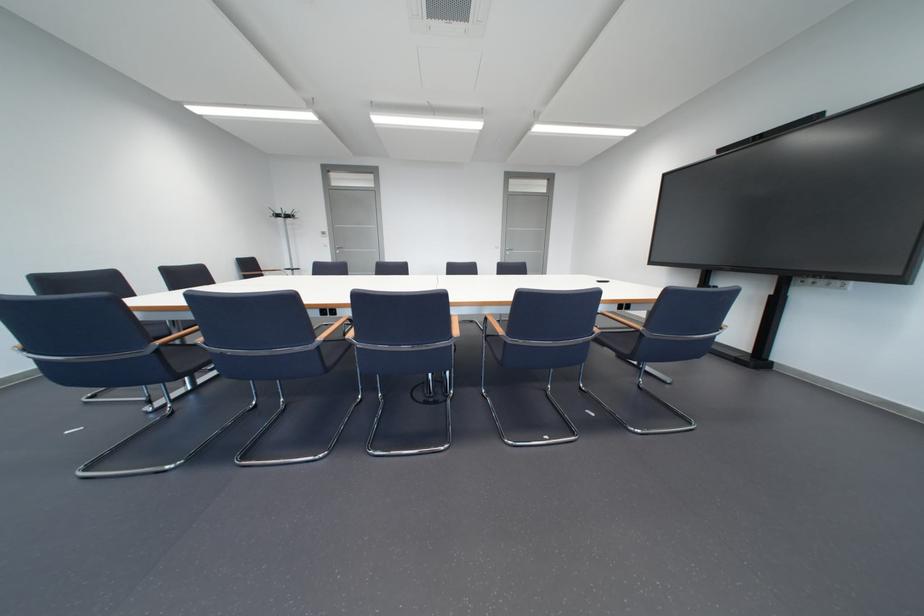
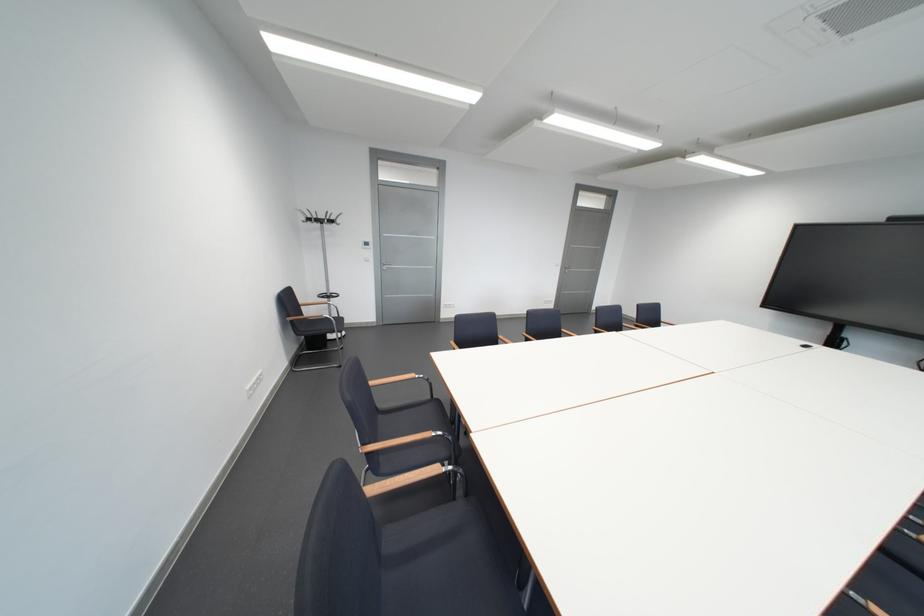
The images are taken continuously from a first-person perspective. In which direction are you moving?

The movement direction of the cameraman is left, forward.